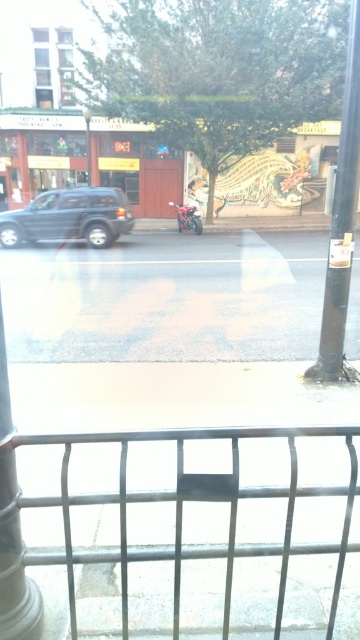
You are standing inside a building looking out through a reflective window. You notice two points marked on the glass at coordinates point (146, 305) and point (352, 244). Which point is closer to you?

Point (352, 244) is closer to you because it is in front of point (146, 305).

You are standing on a balcony and looking out through a reflective window. You notice a metallic silver fence at lower center. Where exactly is the metallic silver fence located in relation to the point marked at coordinates (195, 499)?

The metallic silver fence at lower center is located exactly at the point marked at coordinates (195, 499).

You are standing on a balcony and want to know how far you are from a specific point marked as point [276,252] in the scene. Can you determine the distance?

The distance between you and point [276,252] is 15.42 meters.